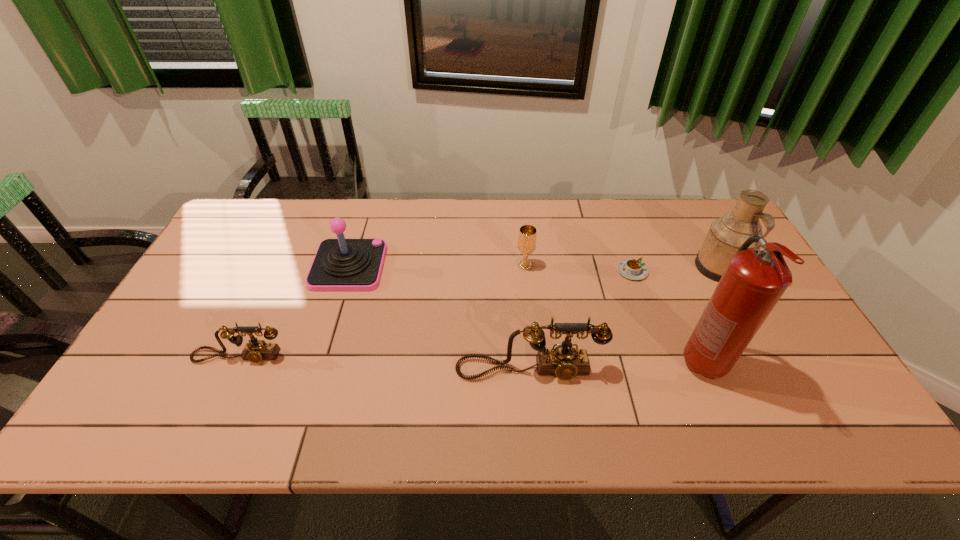
Identify the location of blank region between the joystick and the taller telephone. This screenshot has width=960, height=540. (439, 318).

Where is `vacant space that's between the tallest object and the third shortest object`? This screenshot has width=960, height=540. vacant space that's between the tallest object and the third shortest object is located at coordinates (614, 314).

This screenshot has width=960, height=540. Find the location of `free point between the fifth tallest object and the tallest object`. free point between the fifth tallest object and the tallest object is located at coordinates (614, 314).

The height and width of the screenshot is (540, 960). I want to click on the second closest object to the pudding, so click(753, 282).

Locate which object is the closest to the joystick. Please provide its 2D coordinates. Your answer should be formatted as a tuple, i.e. [(x, y)], where the tuple contains the x and y coordinates of a point satisfying the conditions above.

[(256, 350)]

Image resolution: width=960 pixels, height=540 pixels. Identify the location of vacant region that satisfies the following two spatial constraints: 1. forward from the base of the joystick; 2. on the right side of the pudding. (348, 271).

What are the coordinates of `free spot that satisfies the following two spatial constraints: 1. on the front side of the chalice; 2. forward from the base of the joystick` in the screenshot? It's located at (525, 266).

At what (x,y) coordinates should I click in order to perform the action: click on free space in the image that satisfies the following two spatial constraints: 1. forward from the base of the joystick; 2. on the front-facing side of the left telephone. Please return your answer as a coordinate pair (x, y). This screenshot has width=960, height=540. Looking at the image, I should click on (322, 356).

Find the location of a particular element. The width and height of the screenshot is (960, 540). free location that satisfies the following two spatial constraints: 1. on the back side of the shortest object; 2. forward from the base of the joystick is located at coordinates (631, 266).